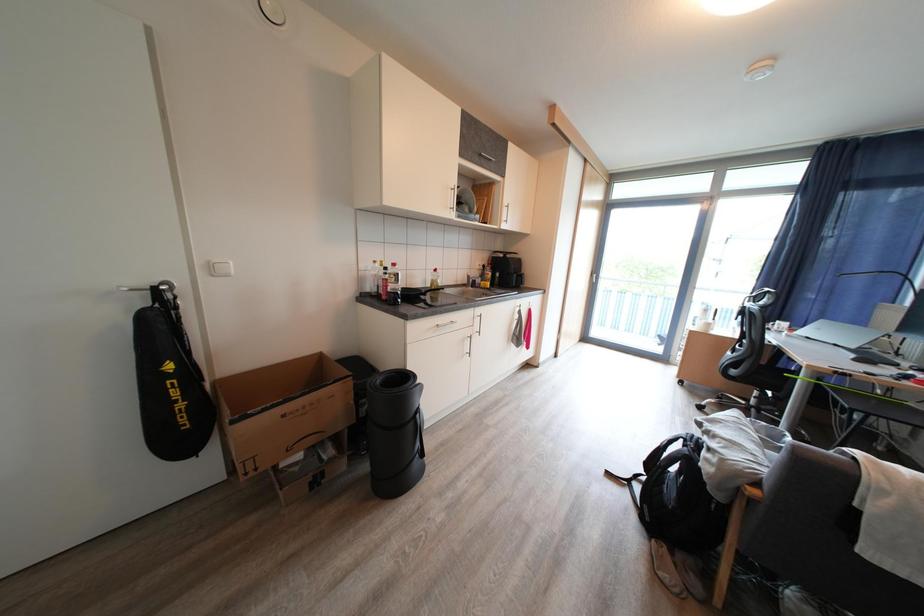
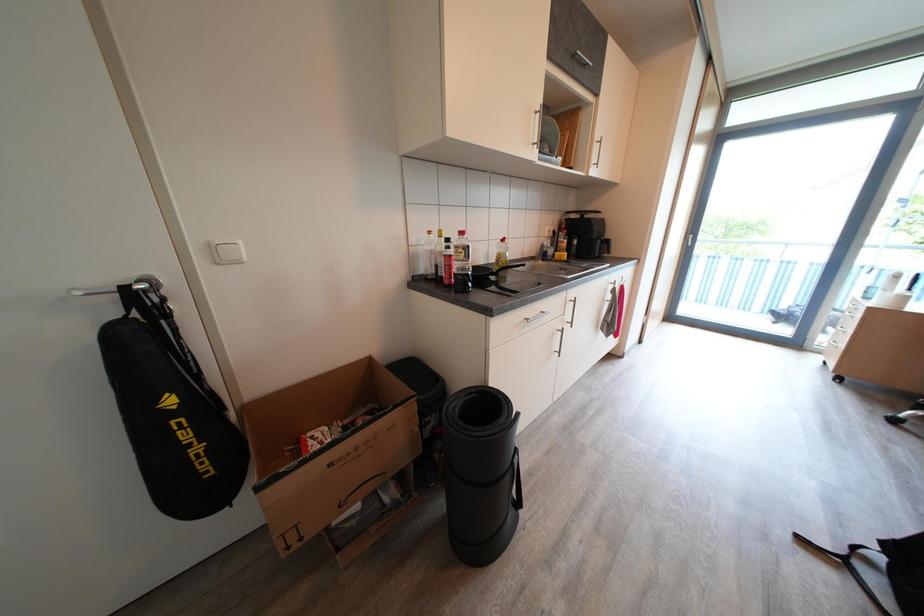
In a continuous first-person perspective shot, in which direction is the camera moving?

The cameraman moved toward left, forward.